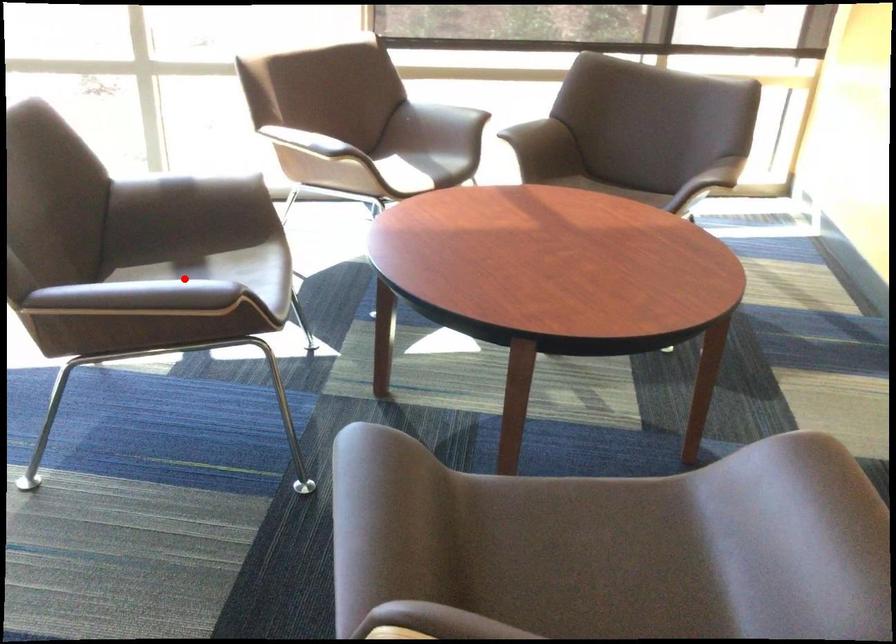
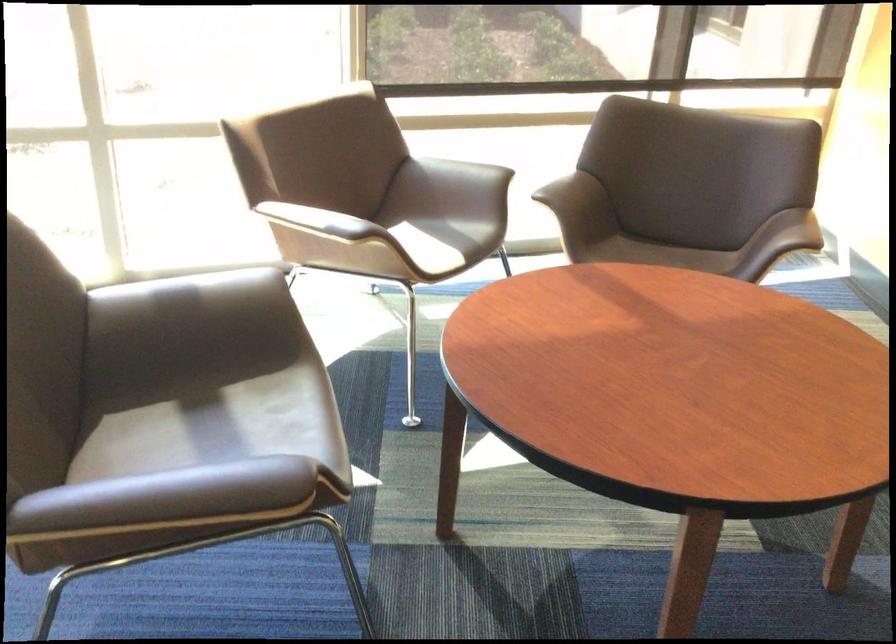
Question: I am providing you with two images of the same scene from different viewpoints. Given a red point in image1, look at the same physical point in image2. Is it:

Choices:
 (A) Closer to the viewpoint
 (B) Farther from the viewpoint

Answer: (A)